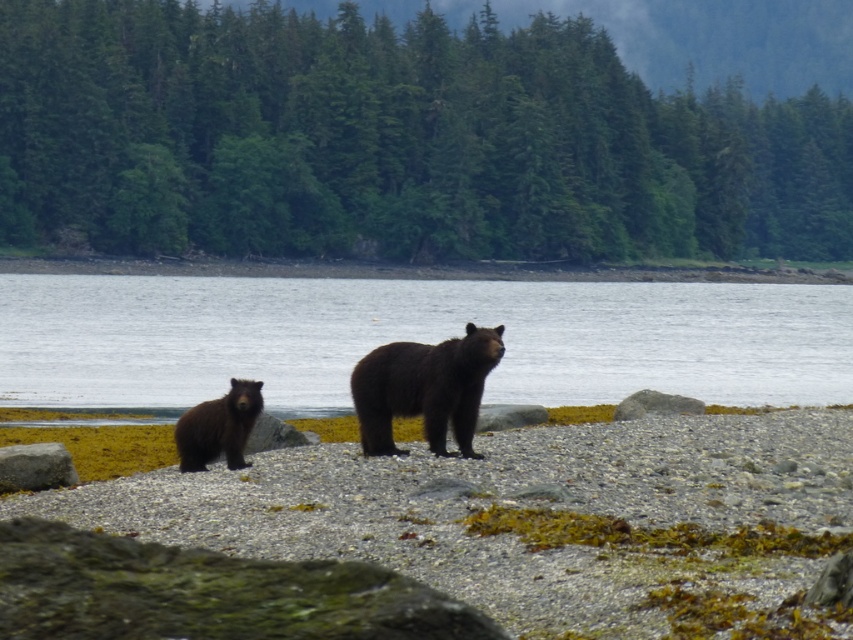
You are standing at the origin point in the image and want to reach the point at the bottom of the image. Which of the two points, point (51,348) or point (381,346), is closer to your destination?

Point (51,348) is behind point (381,346), so the closer point to the bottom of the image would be point (381,346).

Looking at this image, you are a hiker who has spotted a bear in the scene. Where exactly is the brown furry bear at lower left located in terms of coordinates?

The brown furry bear at lower left is located at point (x=218, y=428).

You are standing on the pebbly beach and want to take a photo of the shiny dark brown bear at center without the clear water at center appearing in the background. Is this possible based on their positions?

The clear water at center is further to the viewer than the shiny dark brown bear at center, so the bear is closer to you. To avoid the water in the background, you would need to position yourself so the bear is in front and not framed against the water.